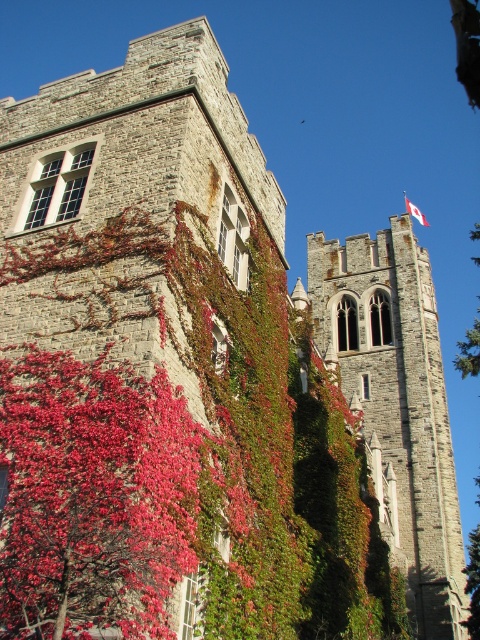
What do you see at coordinates (94, 497) in the screenshot?
I see `vivid red leaves at center` at bounding box center [94, 497].

Can you confirm if vivid red leaves at center is thinner than white fabric flag at upper right?

Yes, vivid red leaves at center is thinner than white fabric flag at upper right.

Where is `vivid red leaves at center`? vivid red leaves at center is located at coordinates (94, 497).

Can you confirm if stone tower at upper right is smaller than white fabric flag at upper right?

Indeed, stone tower at upper right has a smaller size compared to white fabric flag at upper right.

At what (x,y) coordinates should I click in order to perform the action: click on stone tower at upper right. Please return your answer as a coordinate pair (x, y). The height and width of the screenshot is (640, 480). Looking at the image, I should click on (396, 404).

Identify the location of stone tower at upper right. (396, 404).

The image size is (480, 640). In order to click on stone tower at upper right in this screenshot , I will do `click(396, 404)`.

Is vivid red leaves at center wider than stone tower at upper right?

No.

Which is above, vivid red leaves at center or stone tower at upper right?

stone tower at upper right is above.

Between point (50, 625) and point (342, 289), which one is positioned in front?

Point (50, 625) is in front.

This screenshot has width=480, height=640. Find the location of `vivid red leaves at center`. vivid red leaves at center is located at coordinates (94, 497).